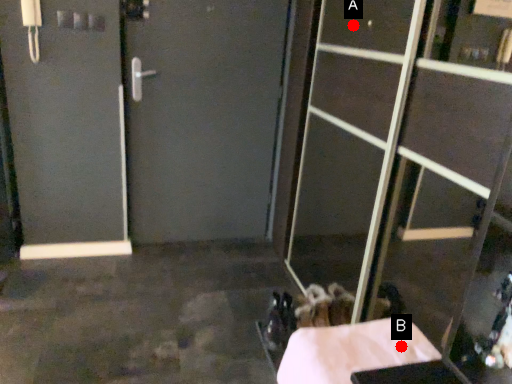
Question: Two points are circled on the image, labeled by A and B beside each circle. Which point is farther to the camera?

Choices:
 (A) A is further
 (B) B is further

Answer: (A)